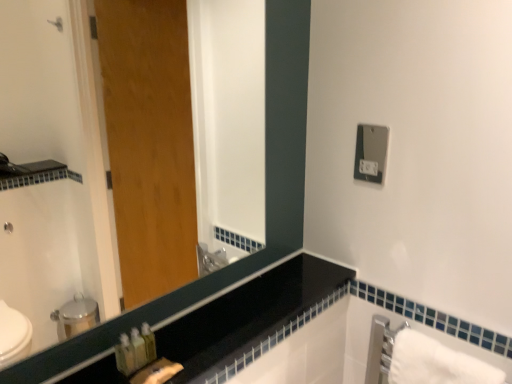
Question: From a real-world perspective, does black glass mirror at upper left sit lower than black glossy counter top at lower left?

Choices:
 (A) yes
 (B) no

Answer: (B)

Question: Is black glass mirror at upper left surrounding black glossy counter top at lower left?

Choices:
 (A) yes
 (B) no

Answer: (B)

Question: From the image's perspective, is black glass mirror at upper left over black glossy counter top at lower left?

Choices:
 (A) no
 (B) yes

Answer: (B)

Question: Can you confirm if black glass mirror at upper left is taller than black glossy counter top at lower left?

Choices:
 (A) no
 (B) yes

Answer: (B)

Question: Does black glass mirror at upper left appear on the right side of black glossy counter top at lower left?

Choices:
 (A) yes
 (B) no

Answer: (B)

Question: Is black glass mirror at upper left located outside black glossy counter top at lower left?

Choices:
 (A) yes
 (B) no

Answer: (A)

Question: Would you say white cotton bath towel at lower right is outside satin silver outlet at upper right?

Choices:
 (A) yes
 (B) no

Answer: (A)

Question: Are white cotton bath towel at lower right and satin silver outlet at upper right far apart?

Choices:
 (A) no
 (B) yes

Answer: (A)

Question: Is white cotton bath towel at lower right behind satin silver outlet at upper right?

Choices:
 (A) no
 (B) yes

Answer: (A)

Question: From a real-world perspective, is white cotton bath towel at lower right positioned under satin silver outlet at upper right based on gravity?

Choices:
 (A) no
 (B) yes

Answer: (B)

Question: From a real-world perspective, is white cotton bath towel at lower right on satin silver outlet at upper right?

Choices:
 (A) yes
 (B) no

Answer: (B)

Question: Is white cotton bath towel at lower right aimed at satin silver outlet at upper right?

Choices:
 (A) yes
 (B) no

Answer: (B)

Question: Can you confirm if black glass mirror at upper left is bigger than satin silver outlet at upper right?

Choices:
 (A) no
 (B) yes

Answer: (B)